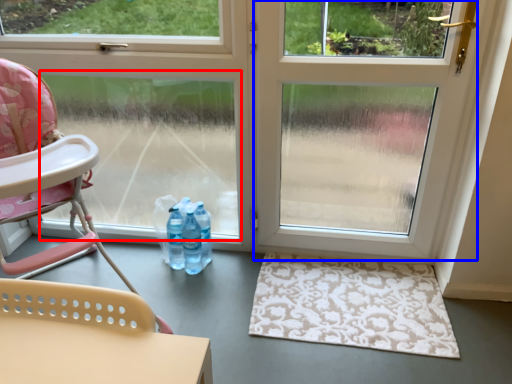
Question: Which of the following is the farthest to the observer, window screen (highlighted by a red box) or screen door (highlighted by a blue box)?

Choices:
 (A) window screen
 (B) screen door

Answer: (A)